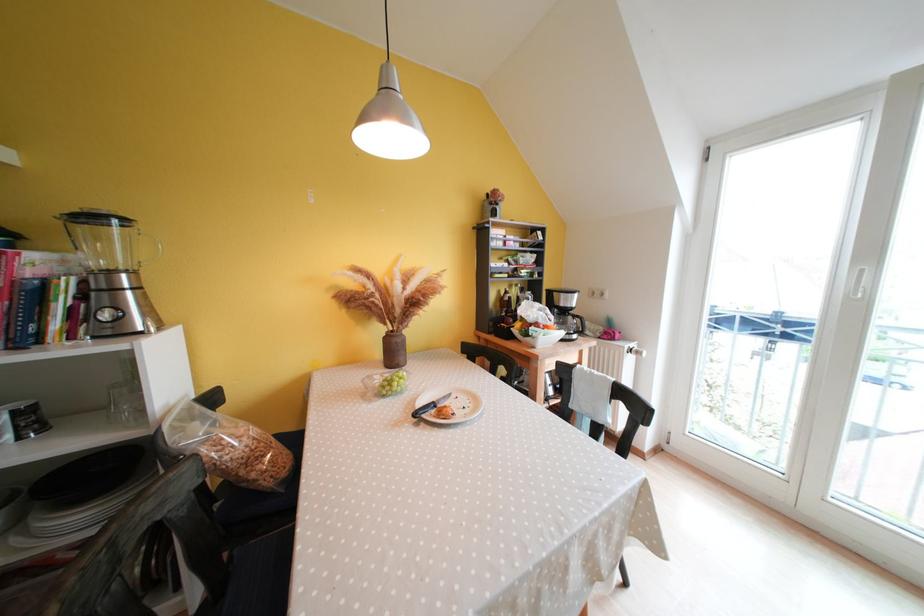
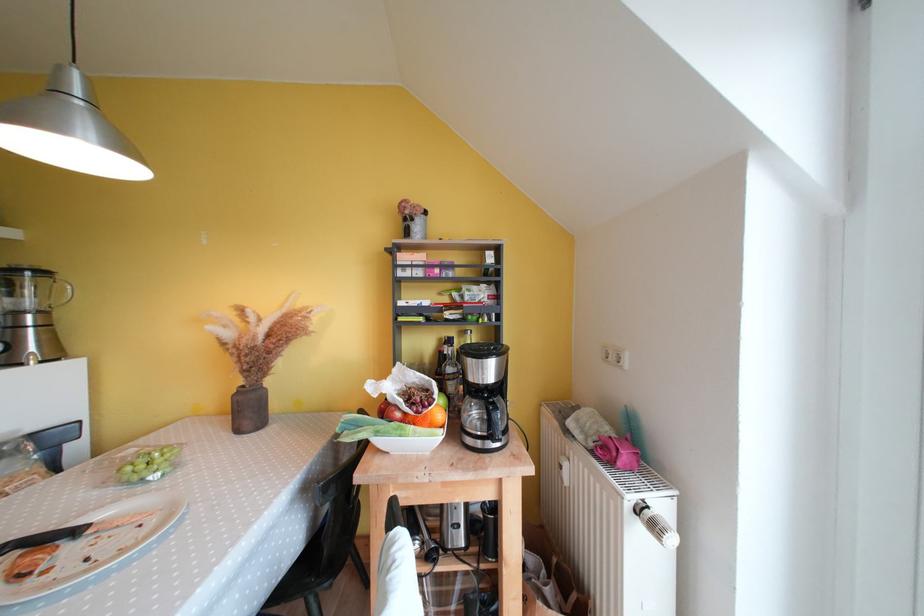
The point at (x=440, y=408) is marked in the first image. Where is the corresponding point in the second image?

(83, 535)